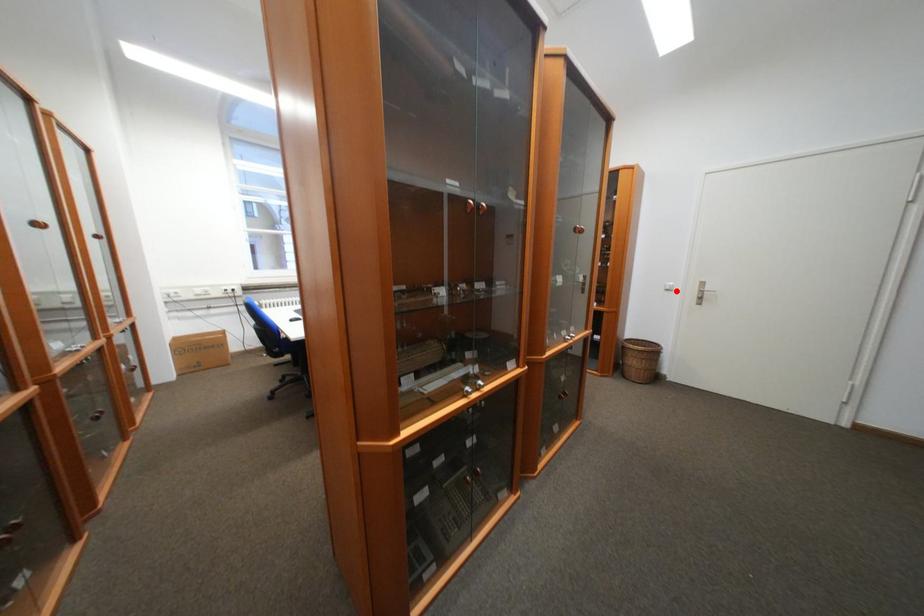
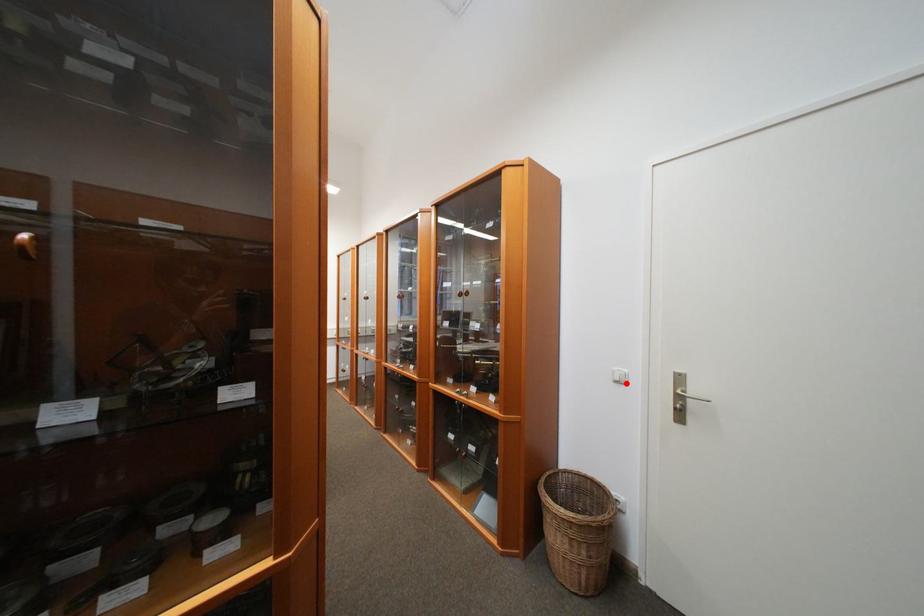
I am providing you with two images of the same scene from different viewpoints. A red point is marked on the first image and another point is marked on the second image. Do the highlighted points in image1 and image2 indicate the same real-world spot?

Yes